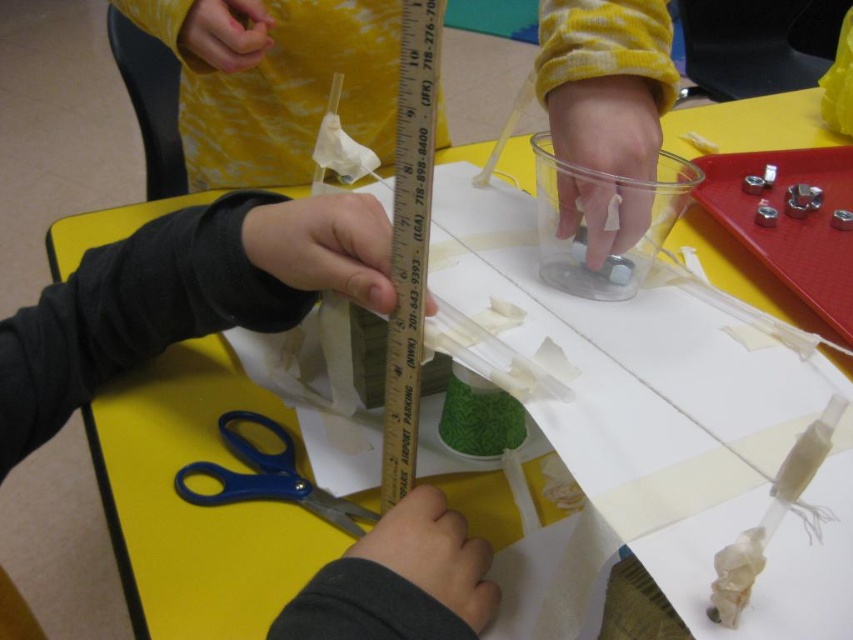
Describe the element at coordinates (409, 241) in the screenshot. I see `metallic ruler at center` at that location.

This screenshot has width=853, height=640. Describe the element at coordinates (409, 241) in the screenshot. I see `metallic ruler at center` at that location.

Find the location of `metallic ruler at center`. metallic ruler at center is located at coordinates (409, 241).